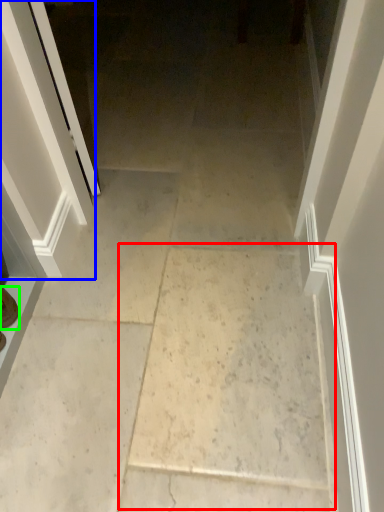
Question: Which object is the farthest from concrete (highlighted by a red box)? Choose among these: screen door (highlighted by a blue box) or footwear (highlighted by a green box).

Choices:
 (A) screen door
 (B) footwear

Answer: (B)